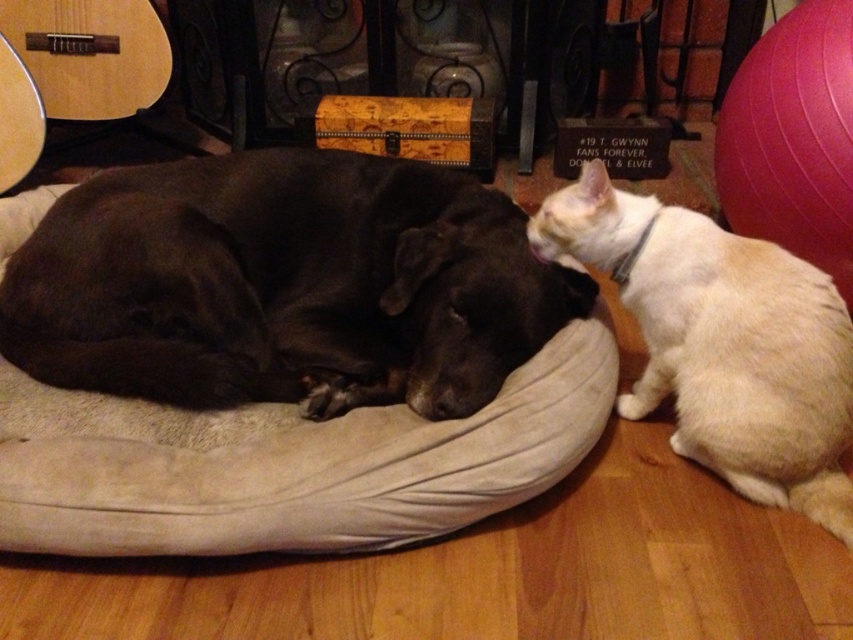
Is shiny black dog at center taller than white fur cat at right?

Incorrect, shiny black dog at center's height is not larger of white fur cat at right's.

Is point (457, 380) positioned after point (761, 246)?

No, it is not.

Image resolution: width=853 pixels, height=640 pixels. In order to click on shiny black dog at center in this screenshot , I will do `click(283, 285)`.